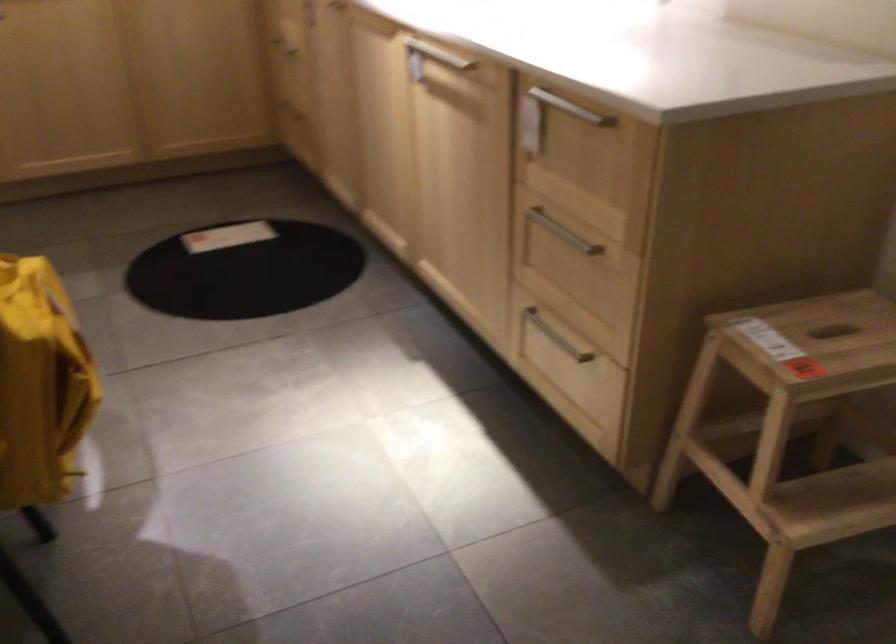
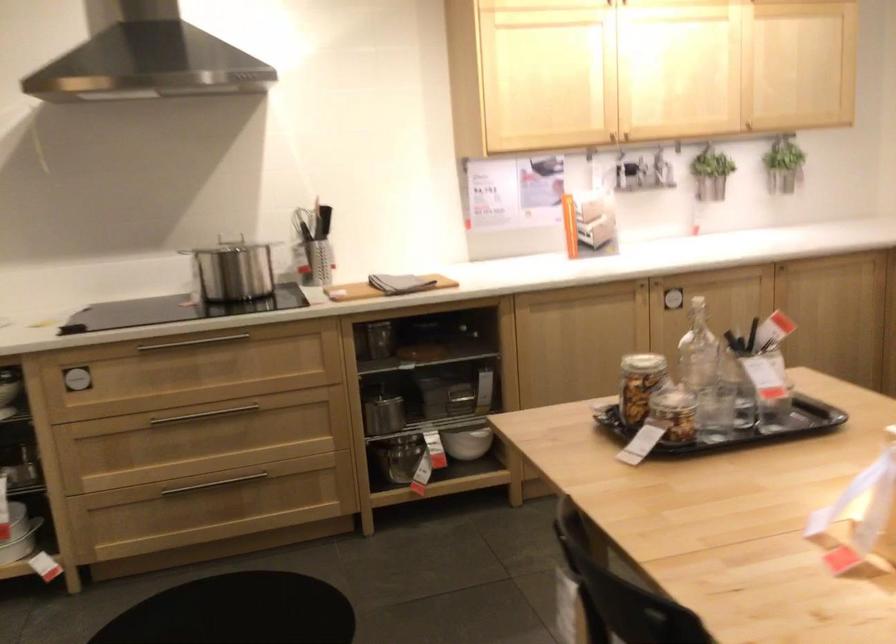
Question: Which direction would the cameraman need to move to produce the second image? Reply with the corresponding letter.

Choices:
 (A) Left
 (B) Right
 (C) Forward
 (D) Backward

Answer: (A)